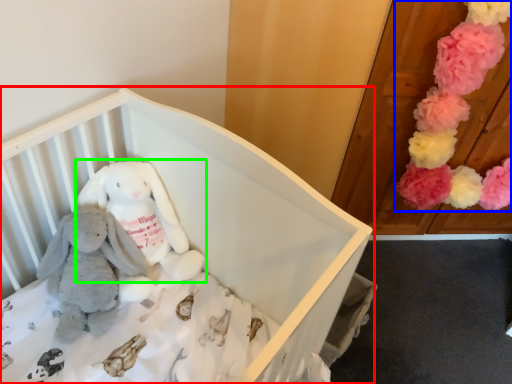
Question: Estimate the real-world distances between objects in this image. Which object is closer to infant bed (highlighted by a red box), toy (highlighted by a blue box) or toy (highlighted by a green box)?

Choices:
 (A) toy
 (B) toy

Answer: (B)